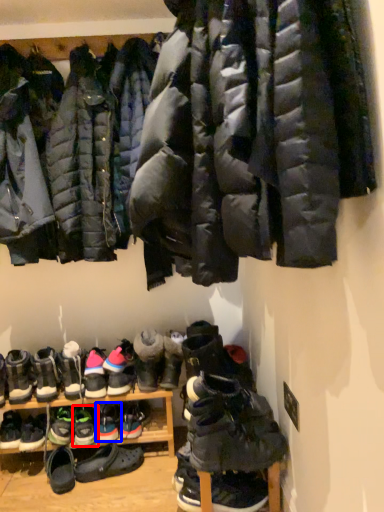
Question: Which of the following is the farthest to the observer, footwear (highlighted by a red box) or footwear (highlighted by a blue box)?

Choices:
 (A) footwear
 (B) footwear

Answer: (B)